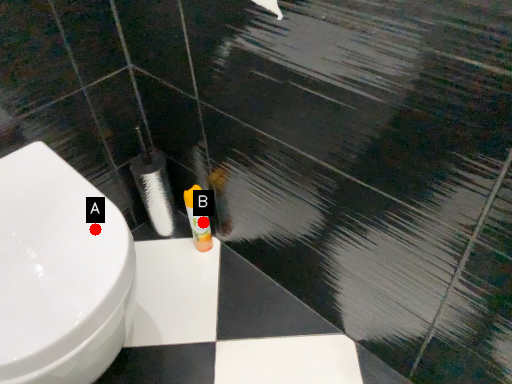
Question: Two points are circled on the image, labeled by A and B beside each circle. Which point is further to the camera?

Choices:
 (A) A is further
 (B) B is further

Answer: (B)